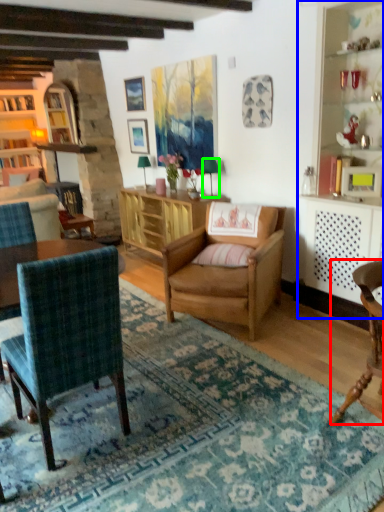
Question: Which is nearer to the chair (highlighted by a red box)? dresser (highlighted by a blue box) or lamp (highlighted by a green box).

Choices:
 (A) dresser
 (B) lamp

Answer: (A)